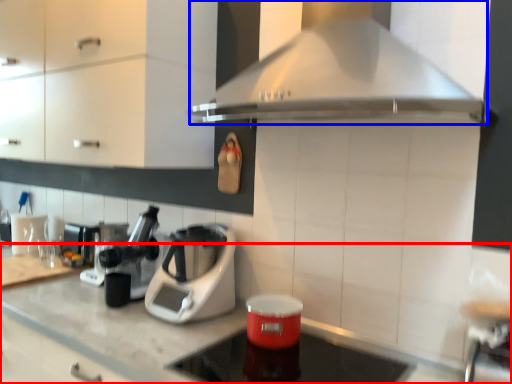
Question: Among these objects, which one is farthest to the camera, countertop (highlighted by a red box) or home appliance (highlighted by a blue box)?

Choices:
 (A) countertop
 (B) home appliance

Answer: (B)